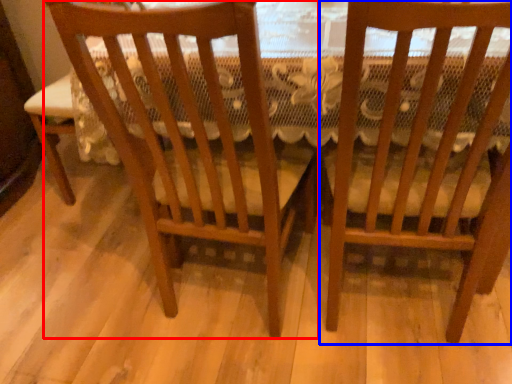
Question: Which point is closer to the camera, chair (highlighted by a red box) or chair (highlighted by a blue box)?

Choices:
 (A) chair
 (B) chair

Answer: (B)